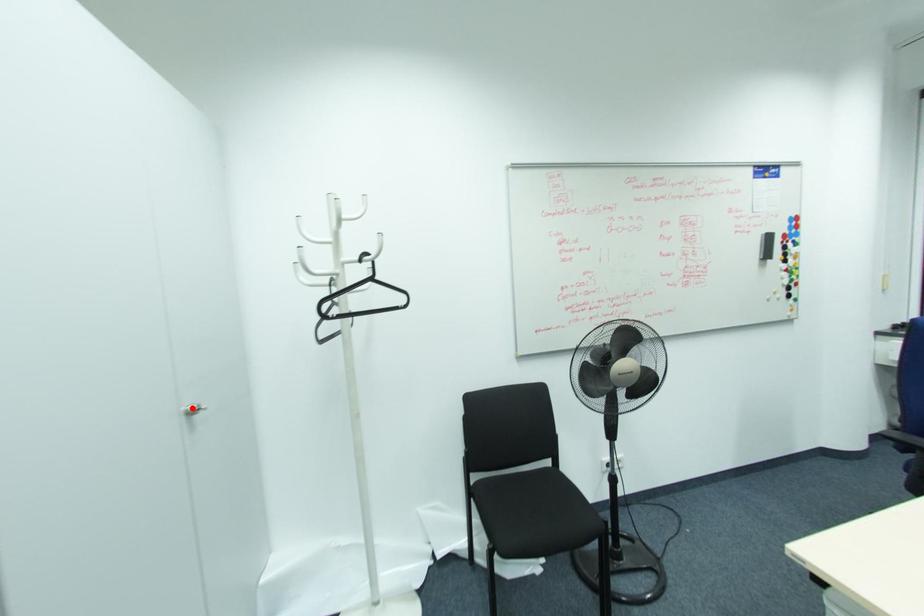
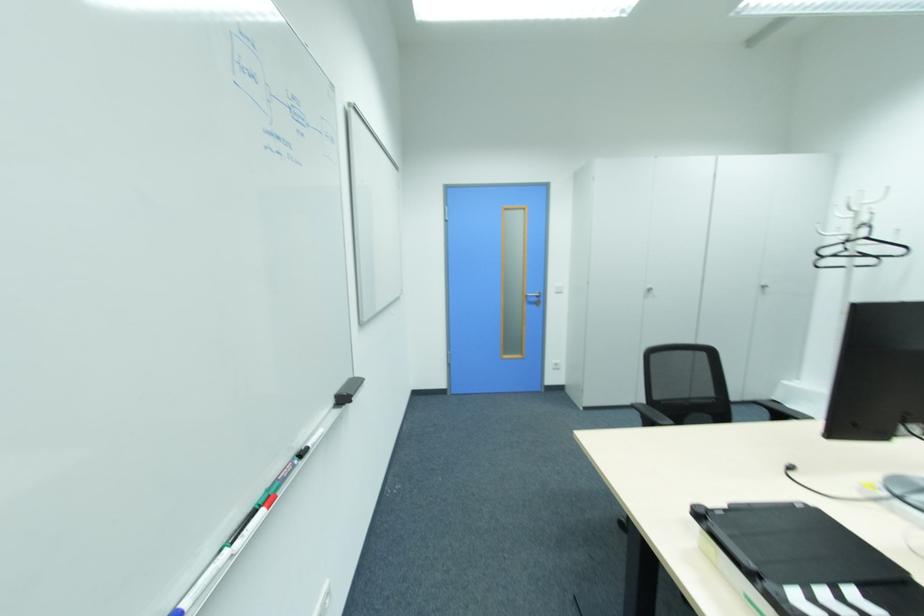
Where in the second image is the point corresponding to the highlighted location from the first image?

(764, 285)